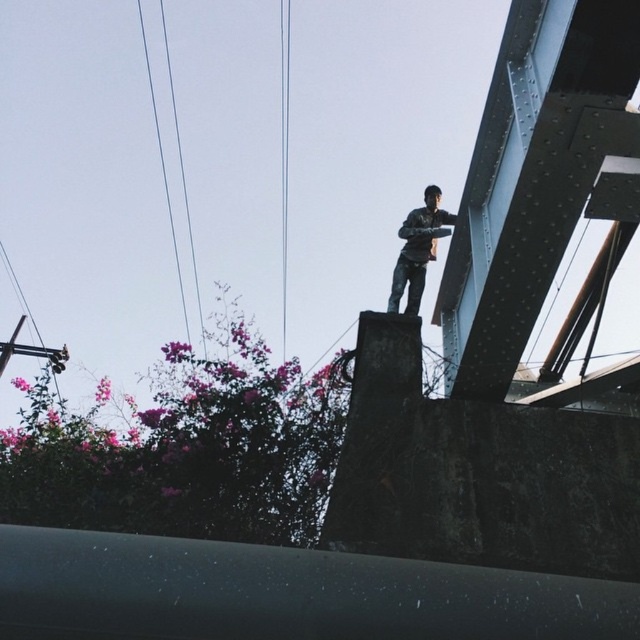
Question: Which object is farther from the camera taking this photo?

Choices:
 (A) metallic wire at center
 (B) dark gray jeans at center

Answer: (A)

Question: Among these objects, which one is farthest from the camera?

Choices:
 (A) dark gray jeans at center
 (B) black wire at upper left
 (C) metallic wire at center

Answer: (C)

Question: Is black wire at upper left below metallic wire at center?

Choices:
 (A) no
 (B) yes

Answer: (B)

Question: Among these points, which one is farthest from the camera?

Choices:
 (A) (428, 234)
 (B) (288, 97)
 (C) (147, 45)

Answer: (C)

Question: Is dark gray jeans at center further to the viewer compared to black wire at upper left?

Choices:
 (A) yes
 (B) no

Answer: (B)

Question: Can you confirm if black wire at upper left is positioned above metallic wire at center?

Choices:
 (A) yes
 (B) no

Answer: (B)